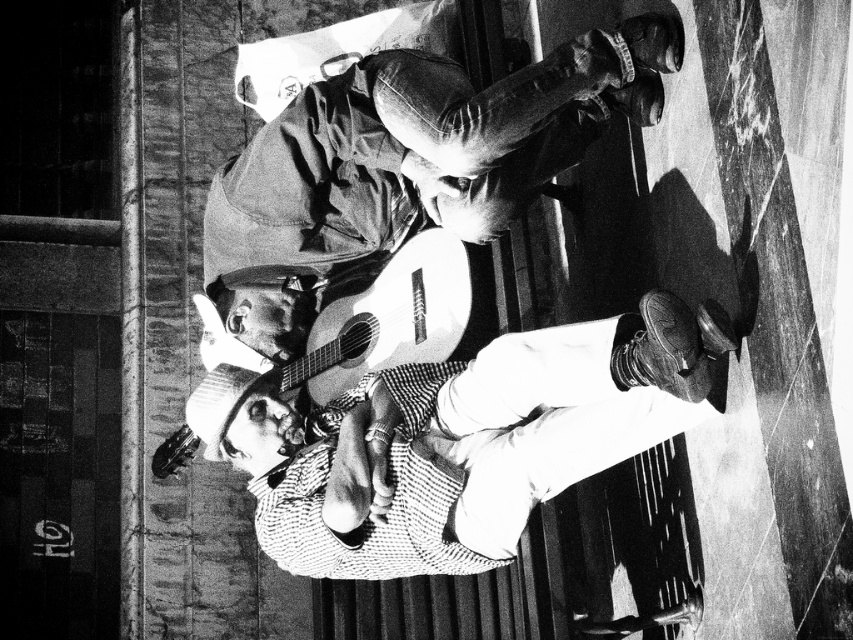
Question: Which object is farther from the camera taking this photo?

Choices:
 (A) checkered fabric shirt at center
 (B) leather jacket at upper center

Answer: (B)

Question: Is checkered fabric shirt at center closer to the viewer compared to leather jacket at upper center?

Choices:
 (A) yes
 (B) no

Answer: (A)

Question: Can you confirm if checkered fabric shirt at center is positioned to the right of leather jacket at upper center?

Choices:
 (A) yes
 (B) no

Answer: (A)

Question: Is checkered fabric shirt at center to the left of leather jacket at upper center from the viewer's perspective?

Choices:
 (A) no
 (B) yes

Answer: (A)

Question: Among these objects, which one is nearest to the camera?

Choices:
 (A) leather jacket at upper center
 (B) checkered fabric shirt at center

Answer: (B)